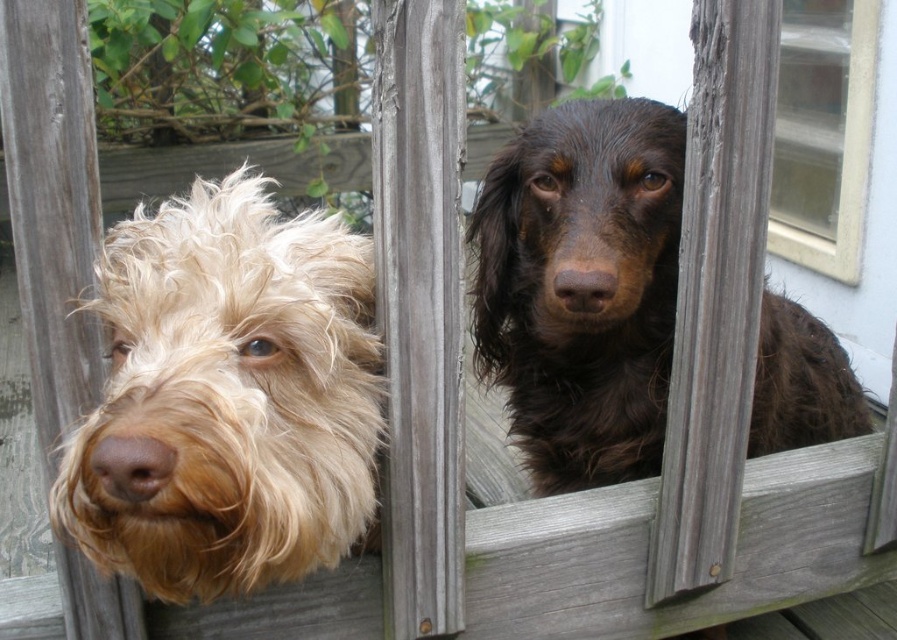
Who is lower down, shiny brown fur at center or brown matte nose at left?

Positioned lower is shiny brown fur at center.

Does shiny brown fur at center appear under brown matte nose at left?

Yes, shiny brown fur at center is below brown matte nose at left.

What do you see at coordinates (582, 268) in the screenshot?
I see `shiny brown fur at center` at bounding box center [582, 268].

Find the location of a particular element. This screenshot has width=897, height=640. shiny brown fur at center is located at coordinates (582, 268).

Does shiny brown fur at center lie behind white plastic window at upper right?

That is False.

Image resolution: width=897 pixels, height=640 pixels. In order to click on shiny brown fur at center in this screenshot , I will do 582,268.

Identify the location of shiny brown fur at center. This screenshot has width=897, height=640. (582, 268).

Which is more to the left, light brown fur at left or brown matte nose at left?

brown matte nose at left is more to the left.

Which is in front, point (376, 444) or point (129, 493)?

Point (129, 493) is in front.

This screenshot has height=640, width=897. I want to click on light brown fur at left, so click(x=231, y=394).